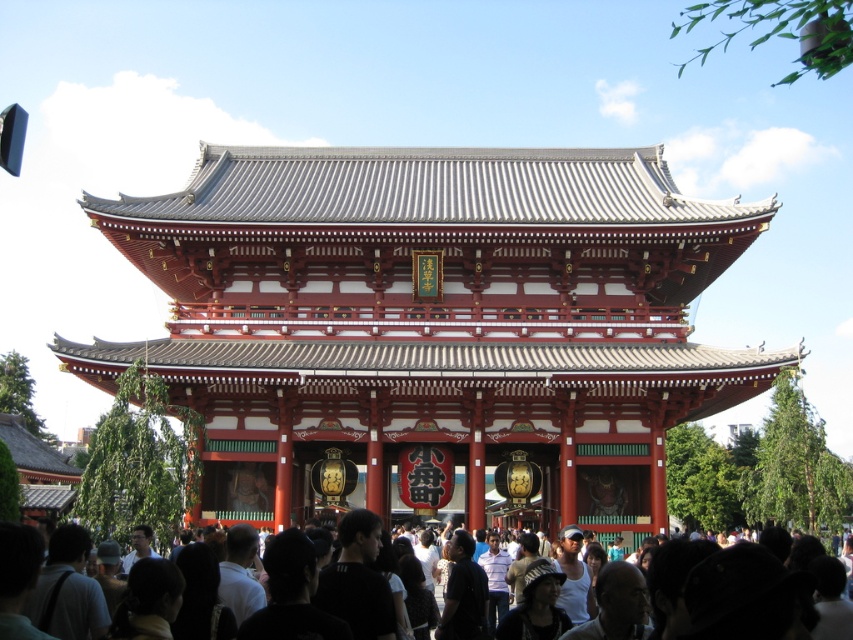
You are standing at the camera position and want to take a photo of the red lacquered wood gate at center. If your camera has a maximum zoom range of 50 meters, will you be able to capture the entire gate in the photo?

The red lacquered wood gate at center and camera are 47.91 meters apart from each other. Since the distance is within the camera maximum zoom range of 50 meters, you can capture the entire gate in the photo.

You are a visitor at the temple and want to take a photo of the red lacquered wood gate at center and dark brown hair at lower center. Since you want both objects to be fully visible in the frame, which object should you focus on to ensure the other is also in the shot?

You should focus on the red lacquered wood gate at center because it is taller than the dark brown hair at lower center, so by focusing on the taller object, the shorter one will naturally be included in the frame.

You are a visitor to the temple and want to take a photo of the red lacquered wood gate at center and dark brown hair at lower center. Which object should you focus on first if you want to include both in the frame without zooming in or out?

The red lacquered wood gate at center is larger in size than dark brown hair at lower center, so you should focus on the red lacquered wood gate at center first to ensure it fits in the frame while still capturing the dark brown hair at lower center.